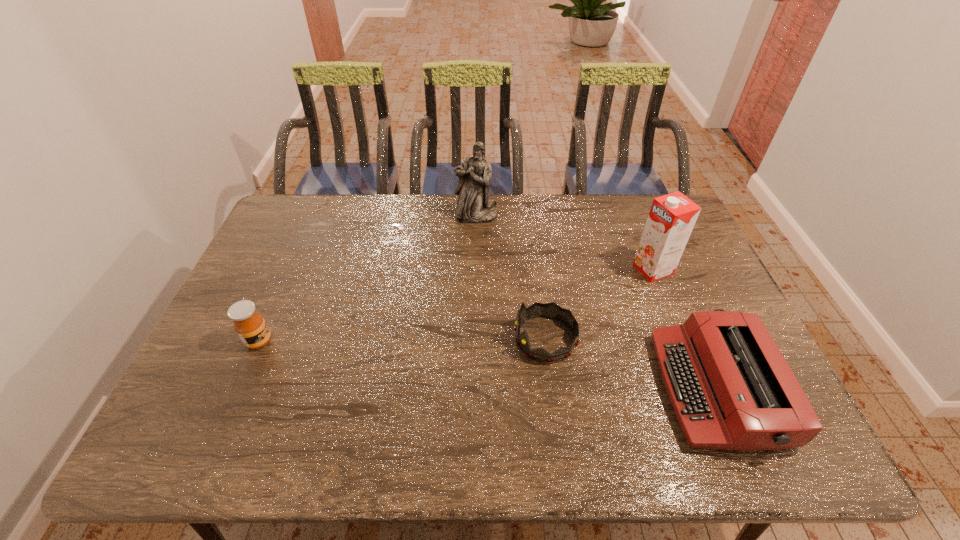
At what (x,y) coordinates should I click in order to perform the action: click on object that is at the near right corner. Please return your answer as a coordinate pair (x, y). The image size is (960, 540). Looking at the image, I should click on (731, 388).

Locate an element on the screen. vacant space at the far edge is located at coordinates (570, 200).

Image resolution: width=960 pixels, height=540 pixels. Identify the location of vacant point at the near edge. (620, 434).

Locate an element on the screen. The width and height of the screenshot is (960, 540). free space at the left edge is located at coordinates (195, 398).

You are a GUI agent. You are given a task and a screenshot of the screen. Output one action in this format:
    pyautogui.click(x=<x>, y=<y>)
    Task: Click on the vacant space at the far left corner
    This screenshot has width=960, height=540.
    Given the screenshot: What is the action you would take?
    pyautogui.click(x=298, y=205)

Where is `blank region between the carton and the honey`? The width and height of the screenshot is (960, 540). blank region between the carton and the honey is located at coordinates (456, 305).

Locate an element on the screen. Image resolution: width=960 pixels, height=540 pixels. free space between the tiara and the second farthest object is located at coordinates (599, 304).

The width and height of the screenshot is (960, 540). In order to click on vacant space in between the tiara and the farthest object in this screenshot , I will do [511, 278].

Find the location of a particular element. This screenshot has height=540, width=960. free area in between the typewriter and the tiara is located at coordinates (631, 363).

Where is `free space that is in between the second object from left to right and the typewriter`? free space that is in between the second object from left to right and the typewriter is located at coordinates (596, 302).